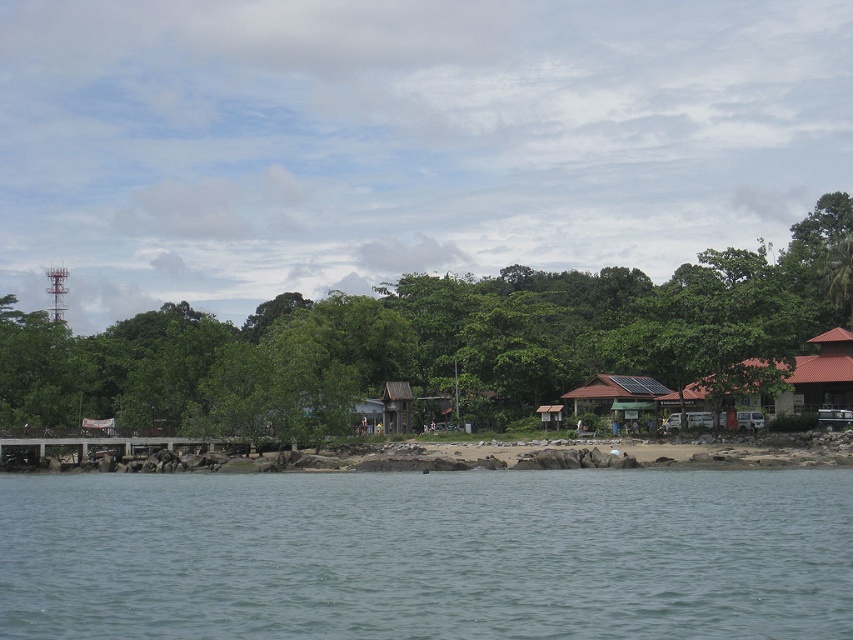
Question: Which is farther from the brown corrugated metal hut at right?

Choices:
 (A) brown wooden dock at lower left
 (B) green leafy tree at center

Answer: (A)

Question: Can you confirm if clear water at lower center is positioned to the right of brown wooden dock at lower left?

Choices:
 (A) no
 (B) yes

Answer: (B)

Question: Does brown wooden dock at lower left appear under brown wooden hut at center-right?

Choices:
 (A) no
 (B) yes

Answer: (B)

Question: Among these points, which one is nearest to the camera?

Choices:
 (A) (833, 364)
 (B) (637, 394)
 (C) (32, 522)
 (D) (51, 445)

Answer: (C)

Question: Which object is closer to the camera taking this photo?

Choices:
 (A) brown wooden dock at lower left
 (B) clear water at lower center
 (C) green leafy tree at center

Answer: (B)

Question: Can you confirm if green leafy tree at center is thinner than brown wooden hut at center-right?

Choices:
 (A) no
 (B) yes

Answer: (A)